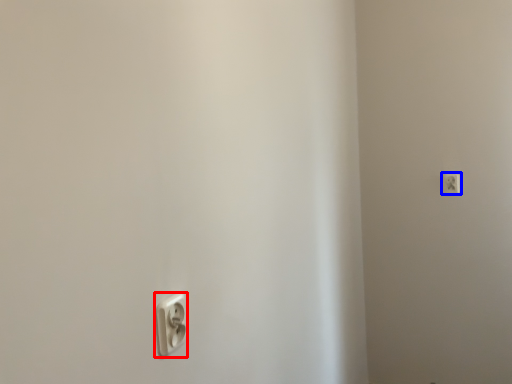
Question: Which object is further to the camera taking this photo, power plugs and sockets (highlighted by a red box) or power plugs and sockets (highlighted by a blue box)?

Choices:
 (A) power plugs and sockets
 (B) power plugs and sockets

Answer: (B)